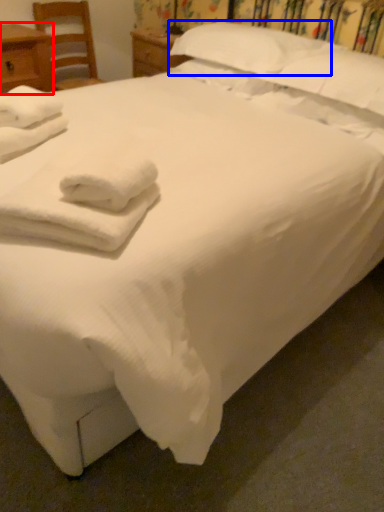
Question: Which object is further to the camera taking this photo, nightstand (highlighted by a red box) or pillow (highlighted by a blue box)?

Choices:
 (A) nightstand
 (B) pillow

Answer: (A)